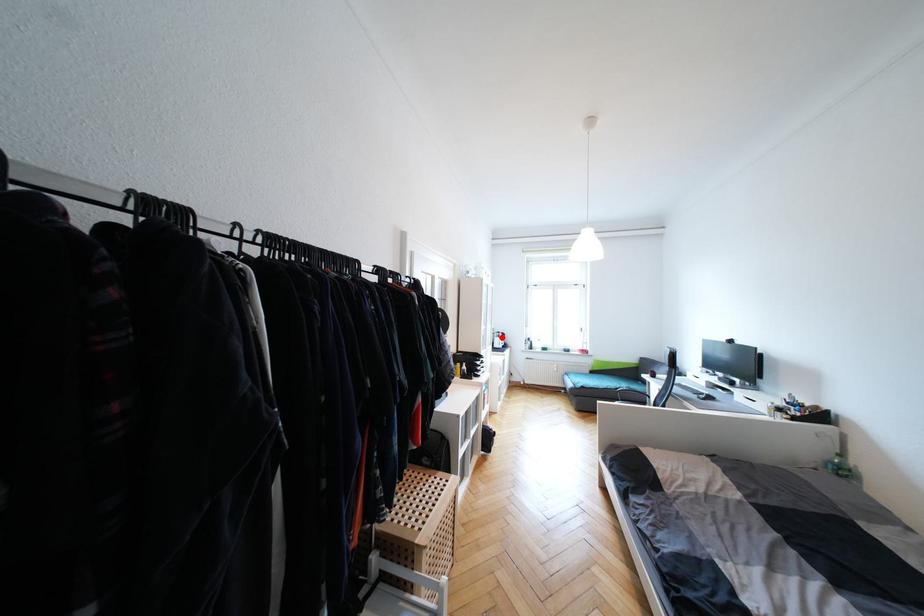
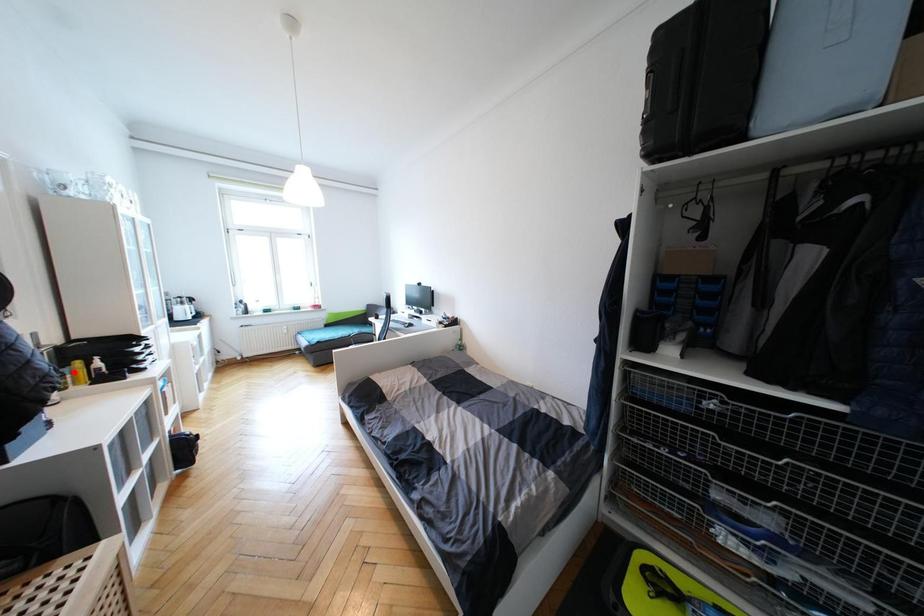
I am providing you with two images of the same scene from different viewpoints. A red point is marked on the first image and another point is marked on the second image. Is the red point in image1 aligned with the point shown in image2?

No